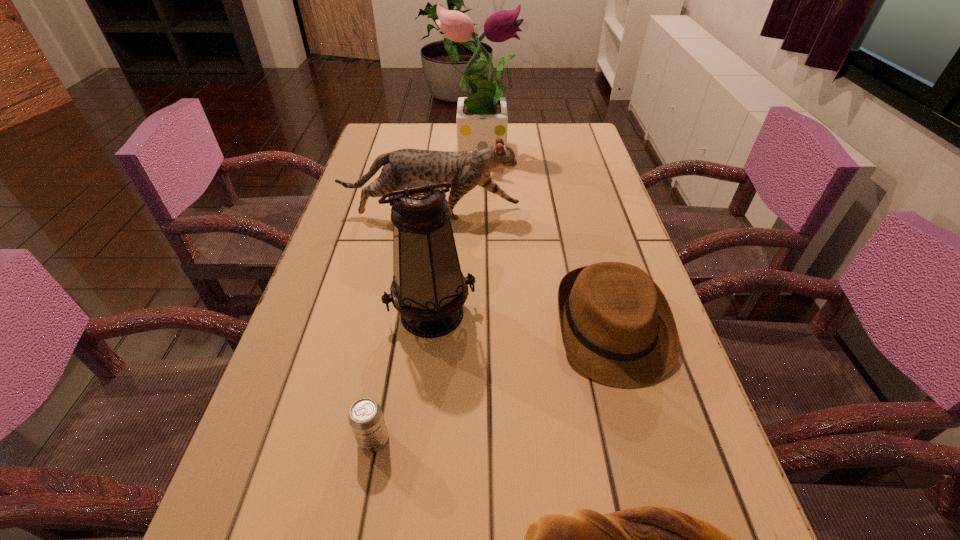
Find the location of a particular element. The width and height of the screenshot is (960, 540). free space between the fedora and the flower arrangement is located at coordinates (545, 239).

Find the location of a particular element. Image resolution: width=960 pixels, height=540 pixels. free space between the tallest object and the oil lamp is located at coordinates (456, 231).

Locate an element on the screen. The image size is (960, 540). free point between the cat and the fedora is located at coordinates (521, 271).

Where is `vacant point located between the beer can and the cat`? The height and width of the screenshot is (540, 960). vacant point located between the beer can and the cat is located at coordinates (402, 326).

Identify which object is the third nearest to the fourth shortest object. Please provide its 2D coordinates. Your answer should be formatted as a tuple, i.e. [(x, y)], where the tuple contains the x and y coordinates of a point satisfying the conditions above.

[(429, 290)]

Identify which object is located as the fourth nearest to the shortest object. Please provide its 2D coordinates. Your answer should be formatted as a tuple, i.e. [(x, y)], where the tuple contains the x and y coordinates of a point satisfying the conditions above.

[(465, 170)]

This screenshot has height=540, width=960. What are the coordinates of `free space in the image that satisfies the following two spatial constraints: 1. on the face of the second farthest object; 2. on the left side of the oil lamp` in the screenshot? It's located at (418, 312).

At what (x,y) coordinates should I click in order to perform the action: click on free space that satisfies the following two spatial constraints: 1. on the face of the oil lamp; 2. on the right side of the fourth shortest object. Please return your answer as a coordinate pair (x, y). The height and width of the screenshot is (540, 960). Looking at the image, I should click on (418, 312).